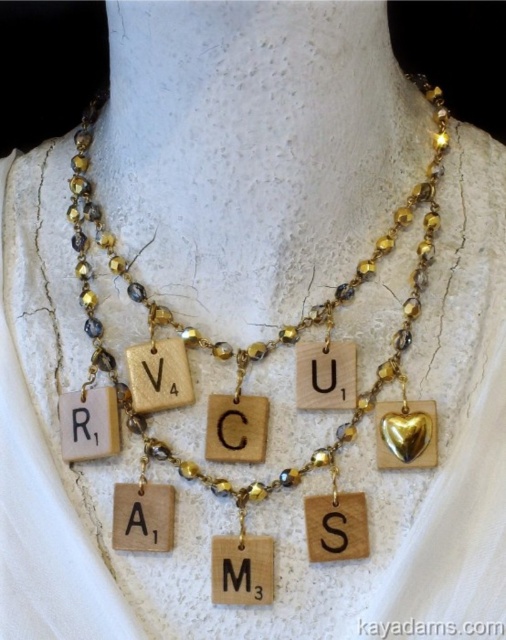
Is matte gold letter m at center shorter than wooden letter at center?

Correct, matte gold letter m at center is not as tall as wooden letter at center.

Does matte gold letter m at center come in front of wooden letter at center?

Yes, it is.

What do you see at coordinates (235, 576) in the screenshot? This screenshot has height=640, width=506. I see `matte gold letter m at center` at bounding box center [235, 576].

In order to click on matte gold letter m at center in this screenshot , I will do `click(235, 576)`.

Is wooden scrabble tiles at center to the left of wooden letter at center from the viewer's perspective?

In fact, wooden scrabble tiles at center is to the right of wooden letter at center.

Is point (110, 371) positioned before point (143, 365)?

No, it is not.

Does point (276, 344) come in front of point (159, 368)?

No, it is behind (159, 368).

Find the location of a particular element. This screenshot has width=506, height=640. wooden scrabble tiles at center is located at coordinates (256, 342).

Can you confirm if wooden scrabble tiles at center is taller than matte gold letter m at center?

Yes, wooden scrabble tiles at center is taller than matte gold letter m at center.

Which is more to the right, wooden scrabble tiles at center or matte gold letter m at center?

From the viewer's perspective, matte gold letter m at center appears more on the right side.

Between point (111, 372) and point (244, 566), which one is positioned in front?

Point (244, 566) is in front.

The height and width of the screenshot is (640, 506). I want to click on wooden scrabble tiles at center, so click(x=256, y=342).